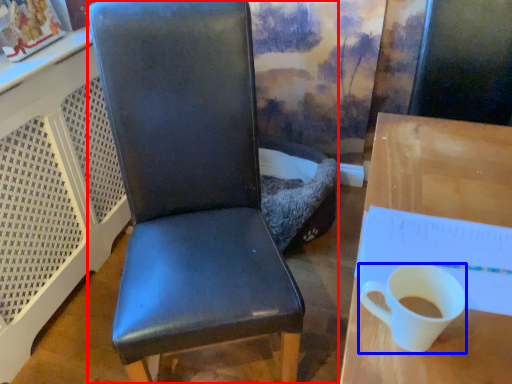
Question: Which of the following is the farthest to the observer, chair (highlighted by a red box) or coffee cup (highlighted by a blue box)?

Choices:
 (A) chair
 (B) coffee cup

Answer: (A)